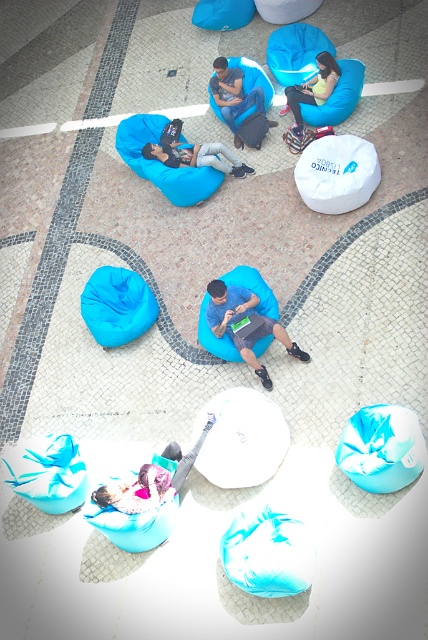
Question: Does matte black laptop at center lie behind matte blue bean bag at upper right?

Choices:
 (A) yes
 (B) no

Answer: (A)

Question: Does matte blue bean bag at lower center come in front of matte blue bean bag at upper right?

Choices:
 (A) yes
 (B) no

Answer: (A)

Question: Which object appears farthest from the camera in this image?

Choices:
 (A) matte blue bean bag at upper left
 (B) matte blue bean bag at upper right
 (C) blue fabric bean bag at center

Answer: (B)

Question: Is matte blue bean bag at lower center to the right of matte blue bean bag at center from the viewer's perspective?

Choices:
 (A) no
 (B) yes

Answer: (A)

Question: Which point is farther to the camera?

Choices:
 (A) matte blue bean bag at upper right
 (B) blue fabric bean bag at center
 (C) matte blue bean bag at lower center
 (D) matte blue bean bag at center

Answer: (D)

Question: Which object is the farthest from the matte blue bean bag at upper right?

Choices:
 (A) matte blue bean bag at lower center
 (B) matte black laptop at center
 (C) matte blue bean bag at upper left
 (D) matte blue bean bag at center

Answer: (A)